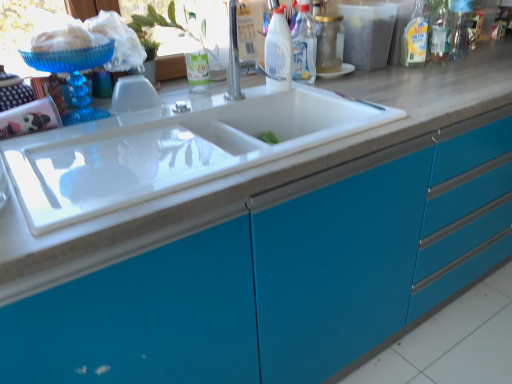
Question: Is transparent glass jar at upper center, marked as the second bottle in a right-to-left arrangement, not close to transparent plastic window screen at upper center?

Choices:
 (A) no
 (B) yes

Answer: (A)

Question: Does transparent glass jar at upper center, marked as the second bottle in a right-to-left arrangement, have a lesser width compared to transparent plastic window screen at upper center?

Choices:
 (A) no
 (B) yes

Answer: (B)

Question: Is transparent glass jar at upper center, the third bottle positioned from the left, facing away from transparent plastic window screen at upper center?

Choices:
 (A) no
 (B) yes

Answer: (A)

Question: From a real-world perspective, is transparent glass jar at upper center, the third bottle positioned from the left, below transparent plastic window screen at upper center?

Choices:
 (A) no
 (B) yes

Answer: (B)

Question: Is transparent plastic window screen at upper center surrounded by transparent glass jar at upper center, marked as the second bottle in a right-to-left arrangement?

Choices:
 (A) no
 (B) yes

Answer: (A)

Question: Is white glossy bottle at upper center, positioned as the first bottle in left-to-right order, spatially inside transparent plastic window screen at upper center, or outside of it?

Choices:
 (A) inside
 (B) outside

Answer: (B)

Question: Is white glossy bottle at upper center, the 4th bottle from the right, taller or shorter than transparent plastic window screen at upper center?

Choices:
 (A) tall
 (B) short

Answer: (B)

Question: Based on their positions, is white glossy bottle at upper center, the 4th bottle from the right, located to the left or right of transparent plastic window screen at upper center?

Choices:
 (A) right
 (B) left

Answer: (A)

Question: Considering the positions of white glossy bottle at upper center, positioned as the first bottle in left-to-right order, and transparent plastic window screen at upper center in the image, is white glossy bottle at upper center, positioned as the first bottle in left-to-right order, wider or thinner than transparent plastic window screen at upper center?

Choices:
 (A) wide
 (B) thin

Answer: (B)

Question: In terms of height, does transparent plastic window screen at upper center look taller or shorter compared to clear plastic bottle at upper right?

Choices:
 (A) tall
 (B) short

Answer: (B)

Question: Is transparent plastic window screen at upper center in front of or behind clear plastic bottle at upper right in the image?

Choices:
 (A) front
 (B) behind

Answer: (A)

Question: Based on their positions, is transparent plastic window screen at upper center located to the left or right of clear plastic bottle at upper right?

Choices:
 (A) right
 (B) left

Answer: (B)

Question: In terms of size, does transparent plastic window screen at upper center appear bigger or smaller than clear plastic bottle at upper right?

Choices:
 (A) big
 (B) small

Answer: (A)

Question: Would you say silver metallic faucet at upper center is to the left or to the right of white glossy bottle at upper center, the 4th bottle from the right, in the picture?

Choices:
 (A) left
 (B) right

Answer: (A)

Question: Considering the positions of point 236,54 and point 285,74, is point 236,54 closer or farther from the camera than point 285,74?

Choices:
 (A) closer
 (B) farther

Answer: (B)